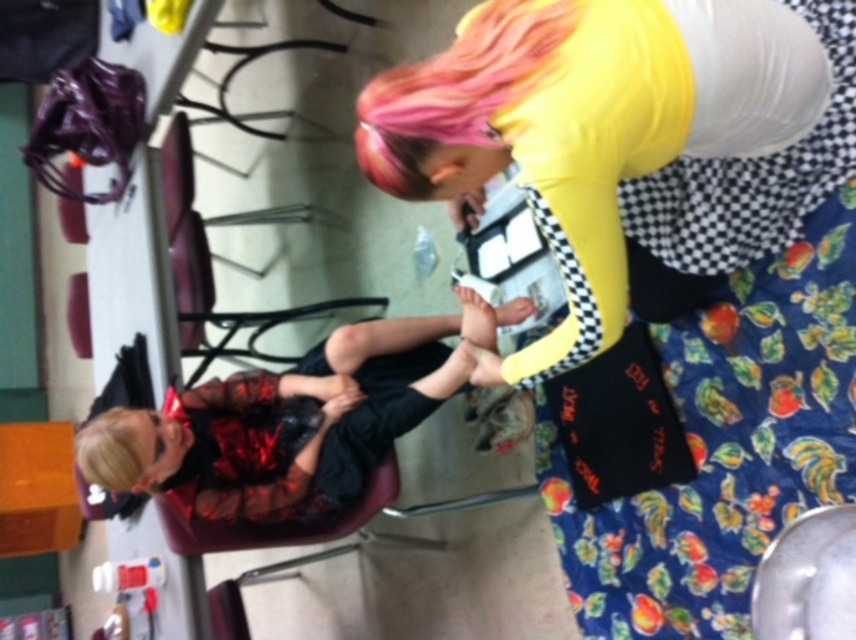
Question: Is shiny black dress at lower left above pink dyed hair at upper center?

Choices:
 (A) no
 (B) yes

Answer: (A)

Question: Among these points, which one is farthest from the camera?

Choices:
 (A) (409, 163)
 (B) (592, 67)

Answer: (A)

Question: Is shiny black dress at lower left above pink dyed hair at upper center?

Choices:
 (A) yes
 (B) no

Answer: (B)

Question: Which object appears farthest from the camera in this image?

Choices:
 (A) shiny black dress at lower left
 (B) matte yellow shirt at upper center
 (C) pink dyed hair at upper center

Answer: (A)

Question: Is shiny black dress at lower left thinner than pink dyed hair at upper center?

Choices:
 (A) yes
 (B) no

Answer: (B)

Question: Which of the following is the closest to the observer?

Choices:
 (A) shiny black dress at lower left
 (B) pink dyed hair at upper center

Answer: (B)